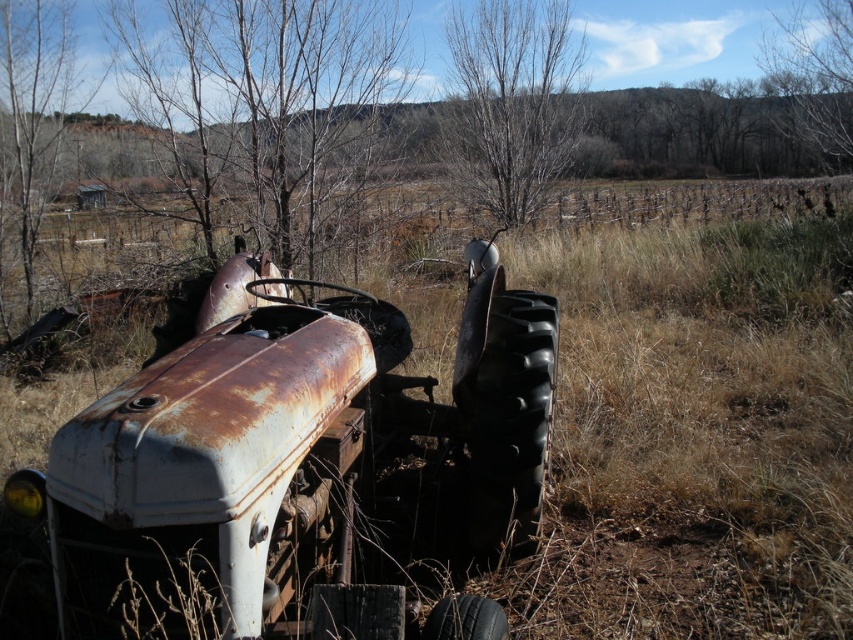
You are standing near the tractor and want to pick up an object that is exactly 50 feet away from you. Is the bare branches at center within reach?

The bare branches at center are 51.72 feet away from the viewer, which is slightly farther than 50 feet. Therefore, they are out of reach.